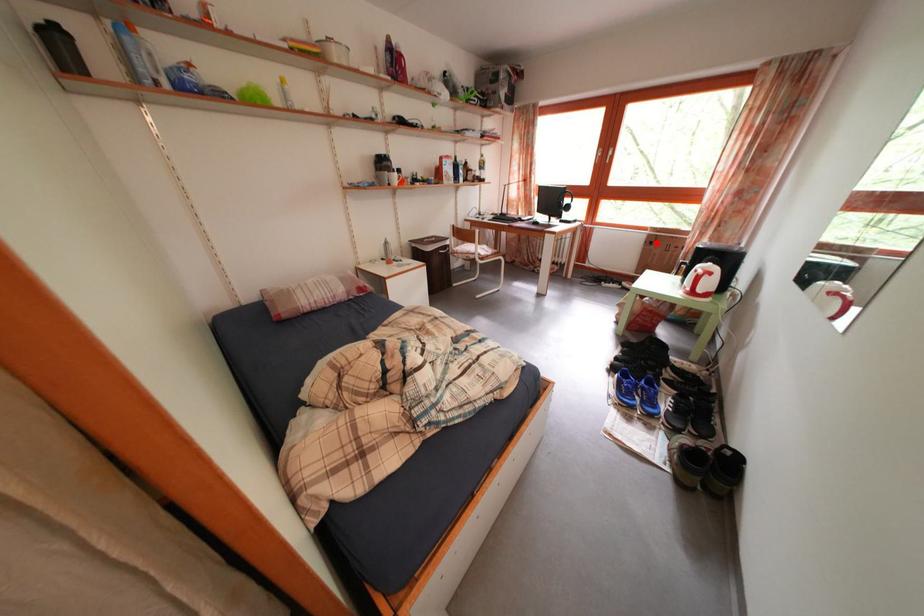
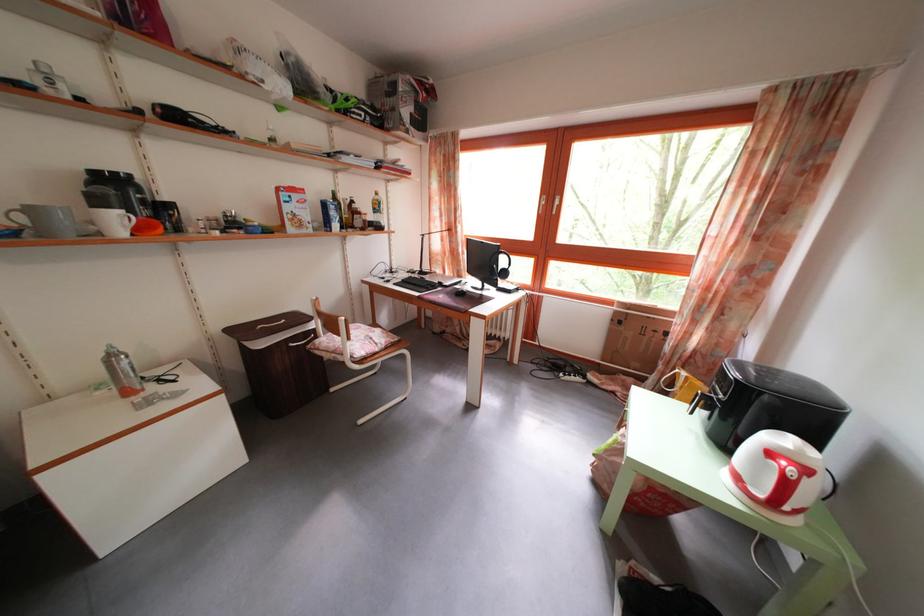
Where in the second image is the point corresponding to the highlighted location from the first image?

(623, 320)